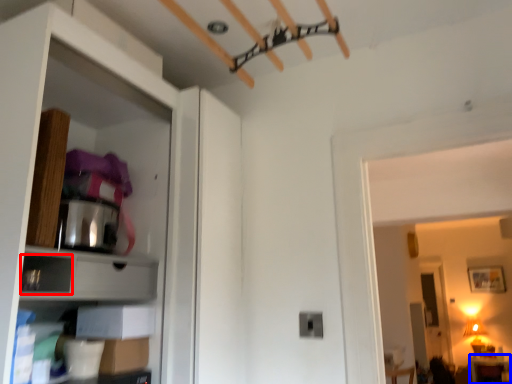
Question: Which object appears farthest to the camera in this image, drawer (highlighted by a red box) or furniture (highlighted by a blue box)?

Choices:
 (A) drawer
 (B) furniture

Answer: (B)